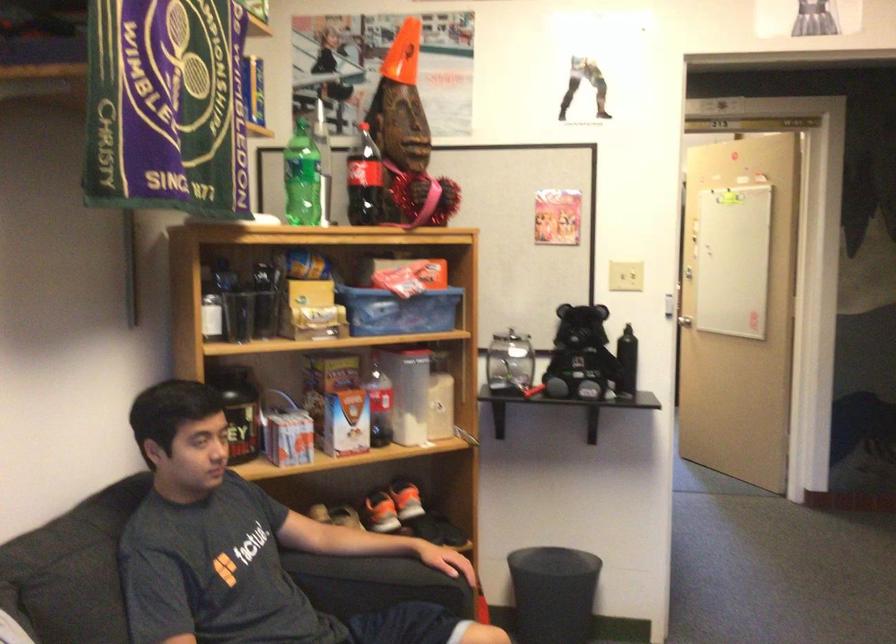
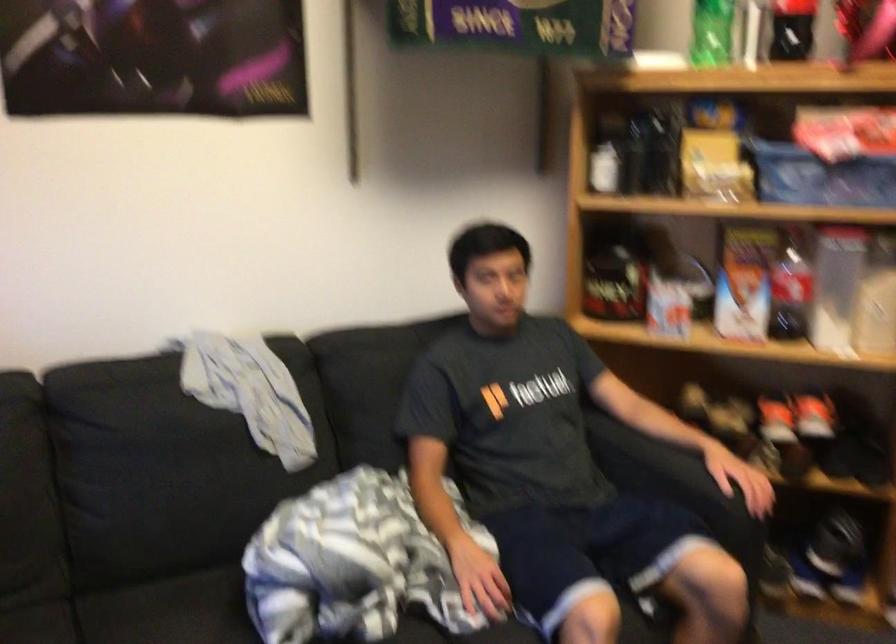
Find the pixel in the second image that matches [402,312] in the first image.

(820, 176)